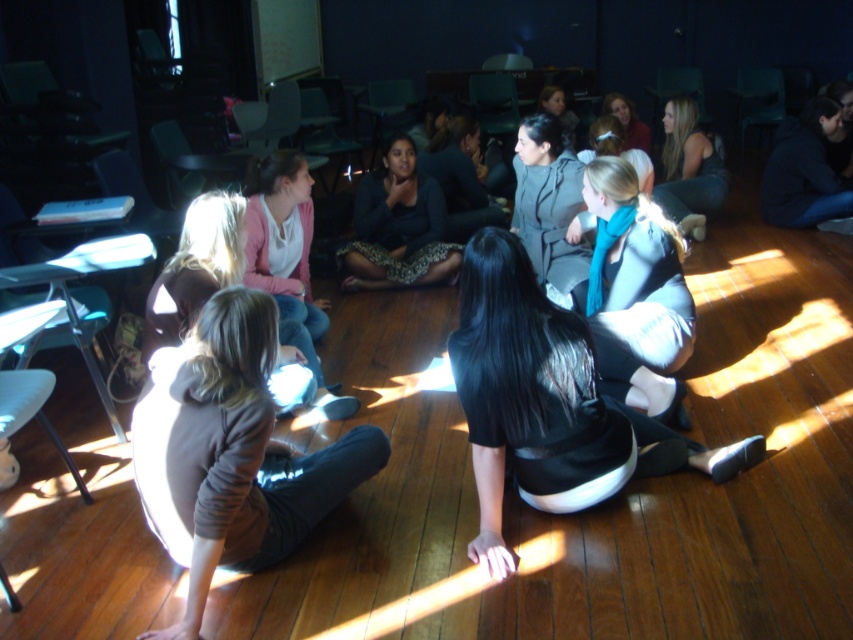
Can you confirm if dark gray/black textured skirt at center is wider than dark brown hair at center?

Indeed, dark gray/black textured skirt at center has a greater width compared to dark brown hair at center.

Is dark gray/black textured skirt at center above dark brown hair at center?

Incorrect, dark gray/black textured skirt at center is not positioned above dark brown hair at center.

Does point (428, 266) come behind point (721, 164)?

That is False.

Find the location of a particular element. The width and height of the screenshot is (853, 640). dark gray/black textured skirt at center is located at coordinates (398, 227).

Who is more forward, (521, 144) or (647, 132)?

Positioned in front is point (521, 144).

The image size is (853, 640). In order to click on matte gray hoodie at center in this screenshot , I will do `click(549, 209)`.

The image size is (853, 640). What are the coordinates of `matte gray hoodie at center` in the screenshot? It's located at (549, 209).

Can you confirm if dark gray hoodie at upper right is positioned to the right of matte gray hoodie at upper center?

Correct, you'll find dark gray hoodie at upper right to the right of matte gray hoodie at upper center.

What do you see at coordinates (805, 170) in the screenshot? I see `dark gray hoodie at upper right` at bounding box center [805, 170].

Which is in front, point (762, 218) or point (624, 97)?

Point (762, 218) is in front.

I want to click on dark gray hoodie at upper right, so click(805, 170).